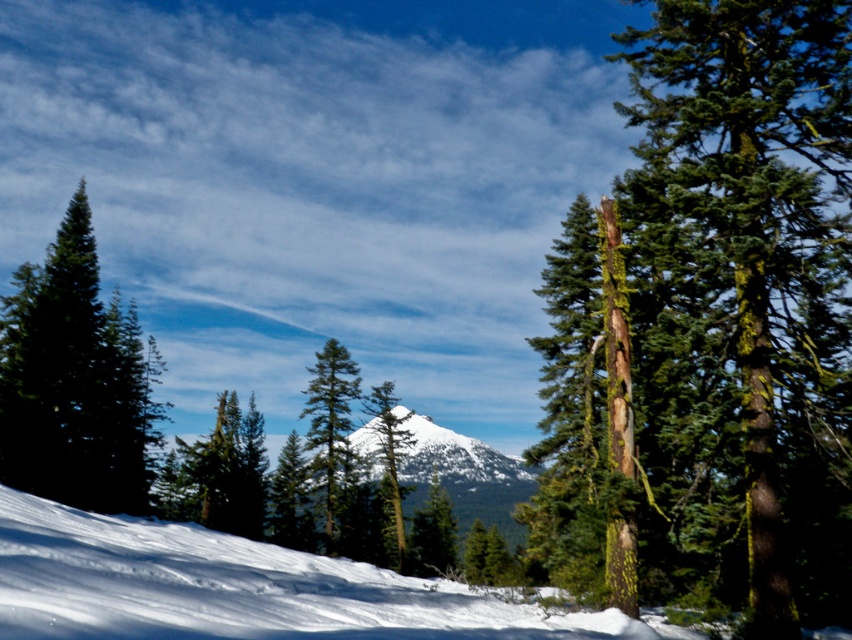
Is point (320, 422) positioned in front of point (377, 401)?

No, (320, 422) is further to viewer.

Can you confirm if green matte tree at center is wider than green mossy tree at center?

Incorrect, green matte tree at center's width does not surpass green mossy tree at center's.

Describe the element at coordinates (329, 419) in the screenshot. The height and width of the screenshot is (640, 852). I see `green matte tree at center` at that location.

At what (x,y) coordinates should I click in order to perform the action: click on green matte tree at center. Please return your answer as a coordinate pair (x, y). The image size is (852, 640). Looking at the image, I should click on (329, 419).

Which is behind, point (67, 333) or point (459, 442)?

The point (459, 442) is behind.

What do you see at coordinates (73, 380) in the screenshot? The height and width of the screenshot is (640, 852). I see `green matte evergreen tree at left` at bounding box center [73, 380].

Find the location of a particular element. The width and height of the screenshot is (852, 640). green matte evergreen tree at left is located at coordinates (73, 380).

Does snowy peak at center have a lesser height compared to green matte tree at center?

No, snowy peak at center is not shorter than green matte tree at center.

Which is below, snowy peak at center or green matte tree at center?

snowy peak at center is below.

You are a GUI agent. You are given a task and a screenshot of the screen. Output one action in this format:
    pyautogui.click(x=<x>, y=<y>)
    Task: Click on the snowy peak at center
    
    Given the screenshot: What is the action you would take?
    pyautogui.click(x=450, y=456)